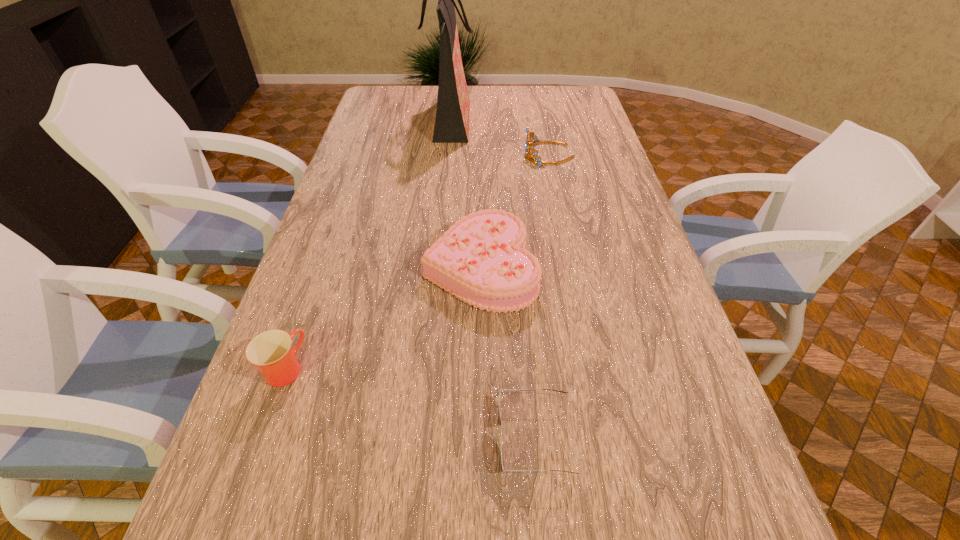
Locate an element on the screen. The height and width of the screenshot is (540, 960). the tallest object is located at coordinates (453, 103).

Identify the location of tiara. Image resolution: width=960 pixels, height=540 pixels. [x=528, y=144].

Find the location of `the leftmost object`. the leftmost object is located at coordinates (271, 351).

Where is `cup`? The height and width of the screenshot is (540, 960). cup is located at coordinates (271, 351).

Find the location of `the third nearest object`. the third nearest object is located at coordinates (482, 260).

Find the location of `the shortest object`. the shortest object is located at coordinates (500, 422).

Where is `sunglasses`? sunglasses is located at coordinates (500, 422).

In order to click on free space located 0.300m on the front side of the shopping bag in this screenshot , I will do `click(553, 123)`.

You are a GUI agent. You are given a task and a screenshot of the screen. Output one action in this format:
    pyautogui.click(x=<x>, y=<y>)
    Task: Click on the free space located 0.050m on the front-facing side of the tiara
    The height and width of the screenshot is (540, 960).
    Given the screenshot: What is the action you would take?
    pyautogui.click(x=510, y=154)

The width and height of the screenshot is (960, 540). What are the coordinates of `free space located on the front-facing side of the tiara` in the screenshot? It's located at (461, 154).